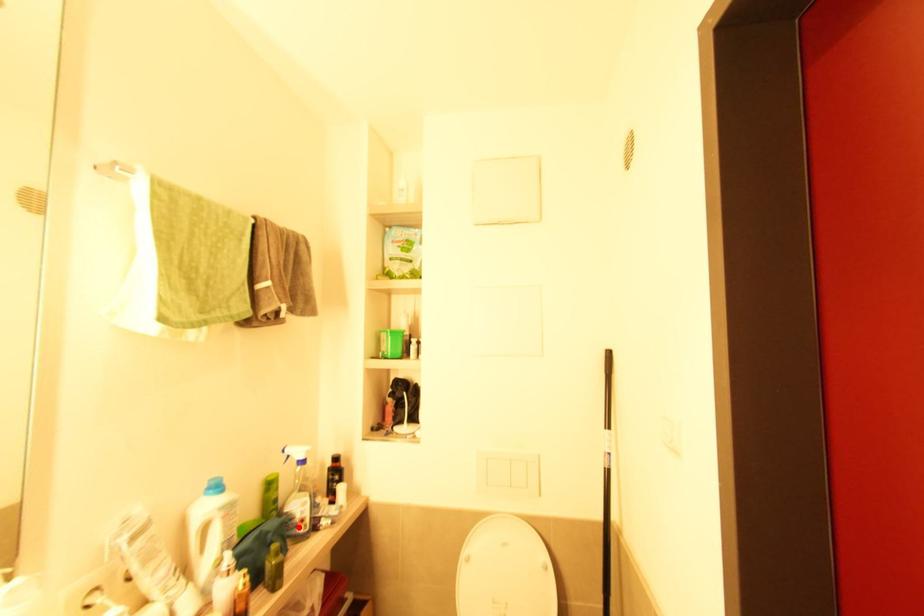
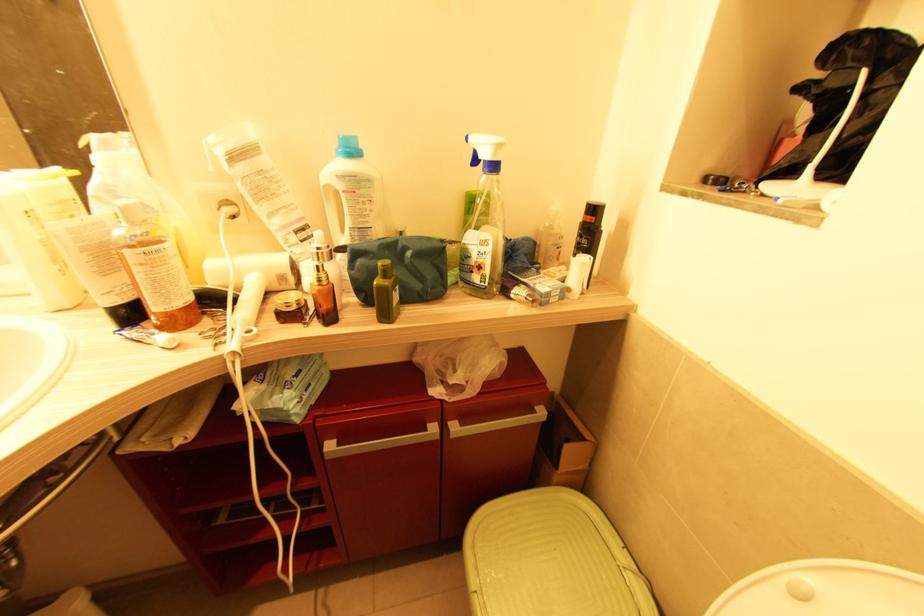
The point at the highlighted location is marked in the first image. Where is the corresponding point in the second image?

(473, 273)